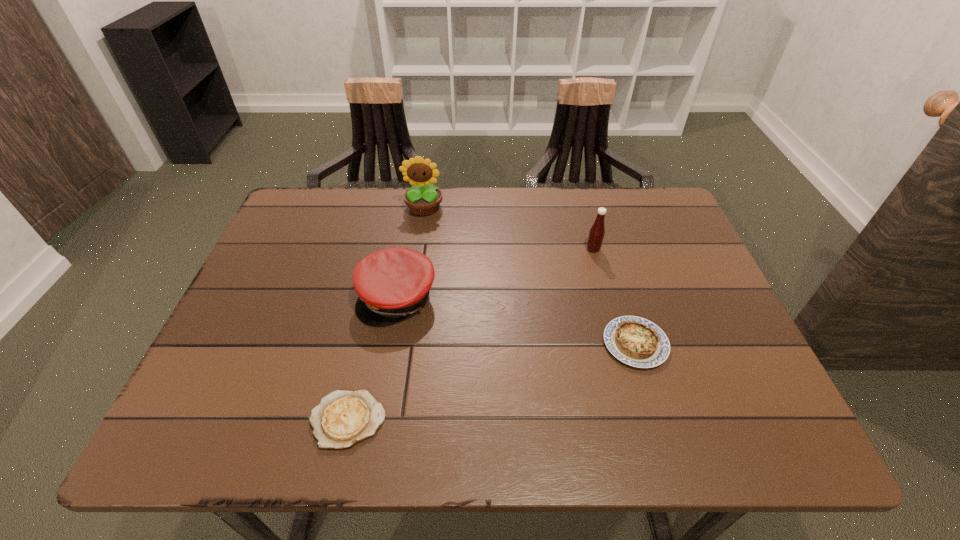
The width and height of the screenshot is (960, 540). In order to click on sunflower in this screenshot , I will do `click(423, 199)`.

Locate an element on the screen. the farthest object is located at coordinates (423, 199).

Locate an element on the screen. The image size is (960, 540). the fourth shortest object is located at coordinates (597, 231).

Find the location of a particular element. The height and width of the screenshot is (540, 960). the second farthest object is located at coordinates [597, 231].

Find the location of a particular element. The image size is (960, 540). the third tallest object is located at coordinates (392, 283).

Locate an element on the screen. This screenshot has height=540, width=960. the second shortest object is located at coordinates (635, 341).

Identify the location of the farther quiche. Image resolution: width=960 pixels, height=540 pixels. (635, 341).

Identify the location of the shortest object. (343, 418).

Locate an element on the screen. This screenshot has width=960, height=540. the nearest object is located at coordinates (343, 418).

Where is `vacant space situated 0.090m on the face of the sunflower`? This screenshot has width=960, height=540. vacant space situated 0.090m on the face of the sunflower is located at coordinates (420, 240).